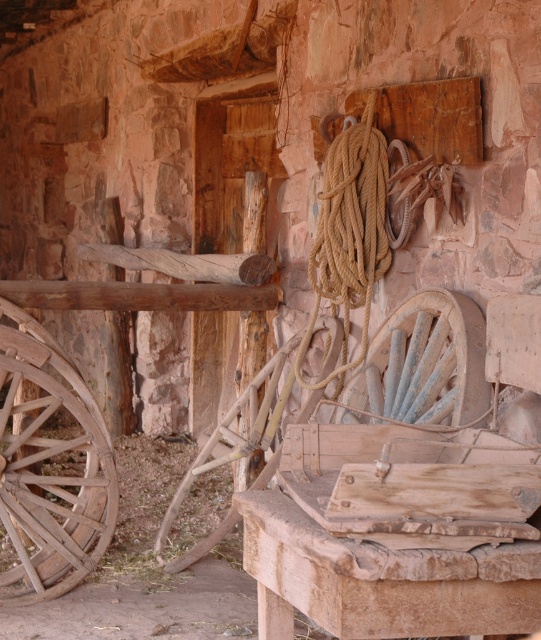
Question: Which of the following is the closest to the observer?

Choices:
 (A) (25, 483)
 (B) (414, 324)

Answer: (B)

Question: Is weathered wood wagon wheel at left closer to camera compared to rusty metal wagon wheel at center?

Choices:
 (A) no
 (B) yes

Answer: (A)

Question: Can you confirm if weathered wood wagon wheel at left is bigger than rusty metal wagon wheel at center?

Choices:
 (A) yes
 (B) no

Answer: (A)

Question: Is weathered wood wagon wheel at left smaller than rusty metal wagon wheel at center?

Choices:
 (A) yes
 (B) no

Answer: (B)